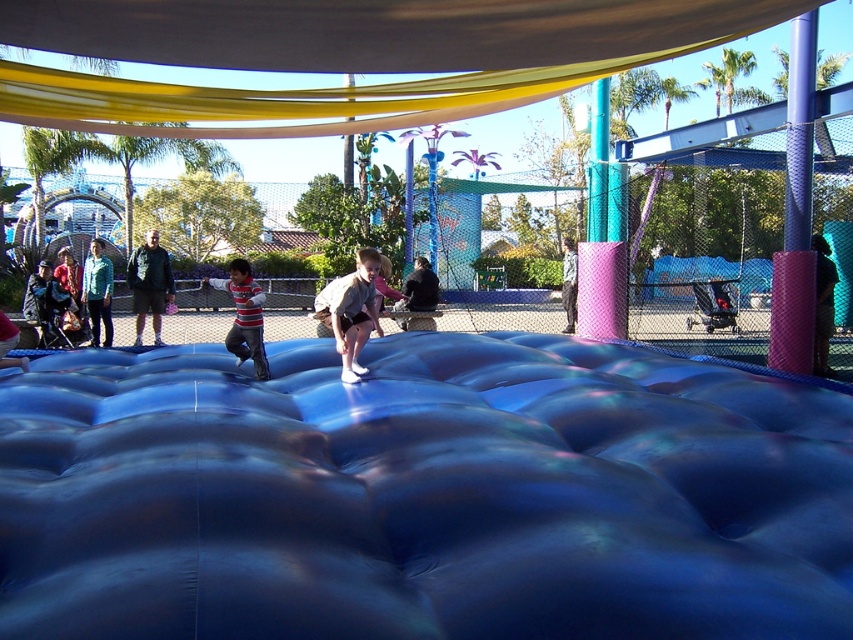
Question: Considering the relative positions of yellow fabric canopy at upper center and dark green jacket at center in the image provided, where is yellow fabric canopy at upper center located with respect to dark green jacket at center?

Choices:
 (A) below
 (B) above

Answer: (B)

Question: Is blue rubberized mat at center behind dark green jacket at center?

Choices:
 (A) yes
 (B) no

Answer: (B)

Question: Which point appears farthest from the camera in this image?

Choices:
 (A) (328, 129)
 (B) (166, 266)

Answer: (B)

Question: Which object is the closest to the striped cotton shirt at center?

Choices:
 (A) dark green jacket at center
 (B) matte gray shorts at center

Answer: (B)

Question: Is striped cotton shirt at center closer to camera compared to dark green jacket at center?

Choices:
 (A) yes
 (B) no

Answer: (A)

Question: Which point appears closest to the camera in this image?

Choices:
 (A) (352, 316)
 (B) (242, 292)
 (C) (413, 115)
 (D) (790, 596)

Answer: (D)